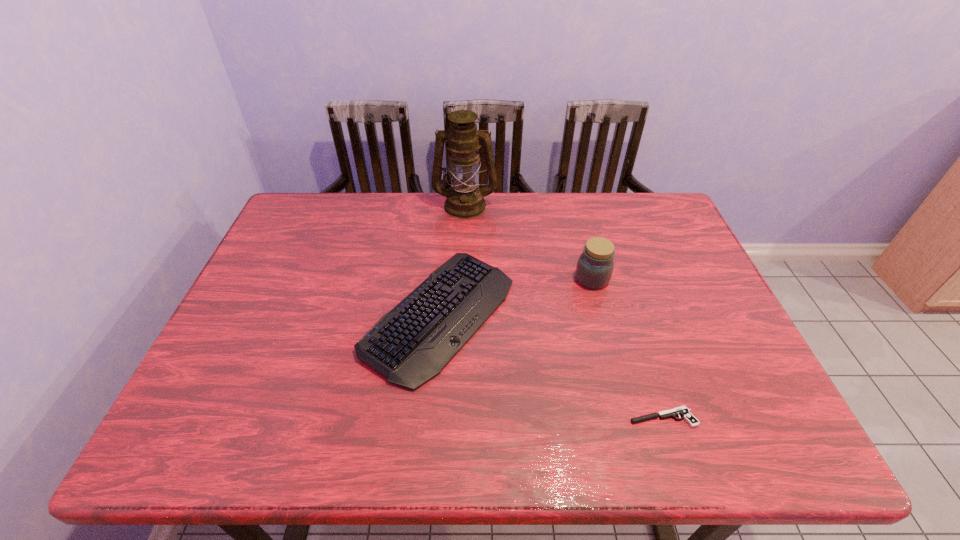
Image resolution: width=960 pixels, height=540 pixels. Identify the location of vacant area that satisfies the following two spatial constraints: 1. on the back side of the tallest object; 2. on the left side of the computer keyboard. (449, 205).